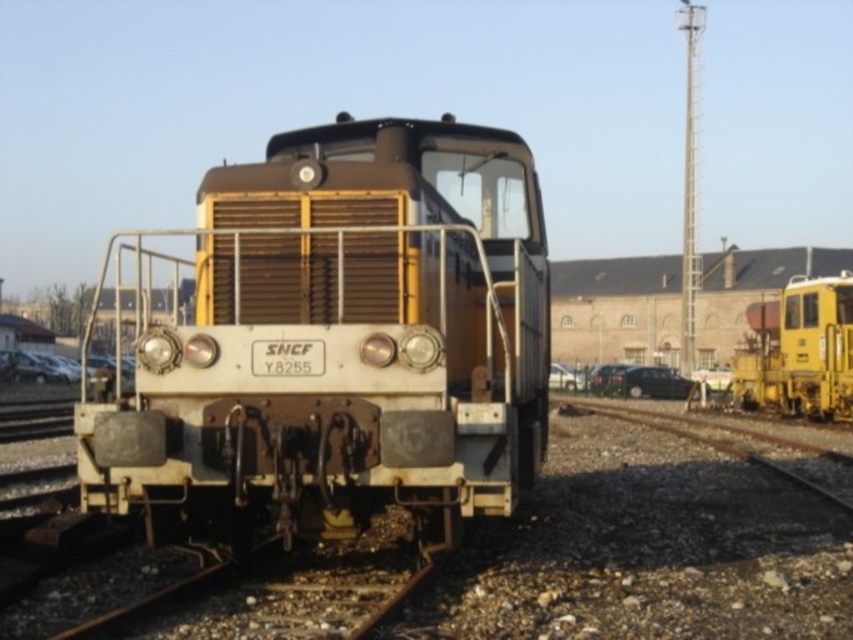
Based on the photo, who is positioned more to the right, yellow matte train at center or yellow matte train at right?

From the viewer's perspective, yellow matte train at right appears more on the right side.

Can you confirm if yellow matte train at center is shorter than yellow matte train at right?

No.

Does point (115, 436) come closer to viewer compared to point (757, 397)?

Yes, it is.

Image resolution: width=853 pixels, height=640 pixels. In order to click on yellow matte train at center in this screenshot , I will do `click(339, 340)`.